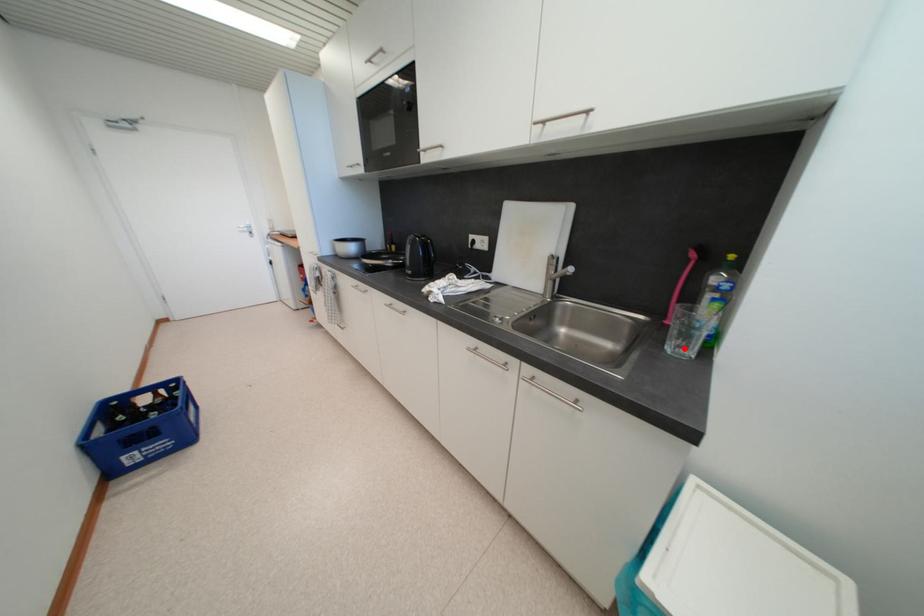
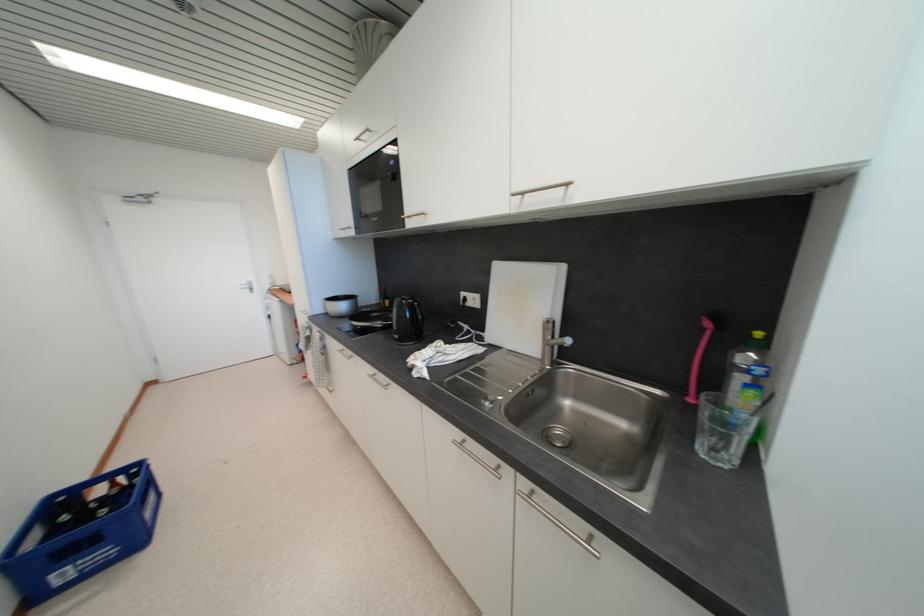
Find the pixel in the second image that matches the highlighted location in the first image.

(720, 453)